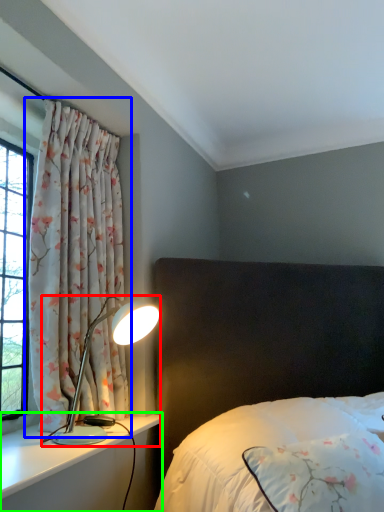
Question: Which is nearer to the lamp (highlighted by a red box)? curtain (highlighted by a blue box) or dresser (highlighted by a green box).

Choices:
 (A) curtain
 (B) dresser

Answer: (B)